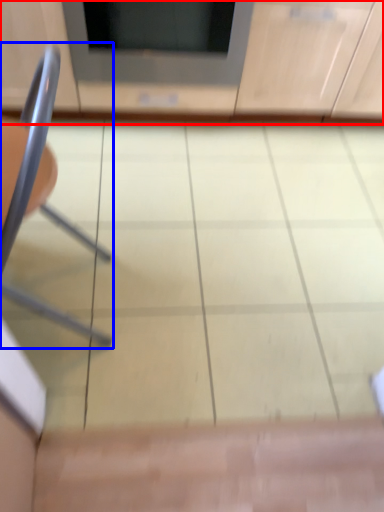
Question: Which object appears farthest to the camera in this image, cabinetry (highlighted by a red box) or chair (highlighted by a blue box)?

Choices:
 (A) cabinetry
 (B) chair

Answer: (A)